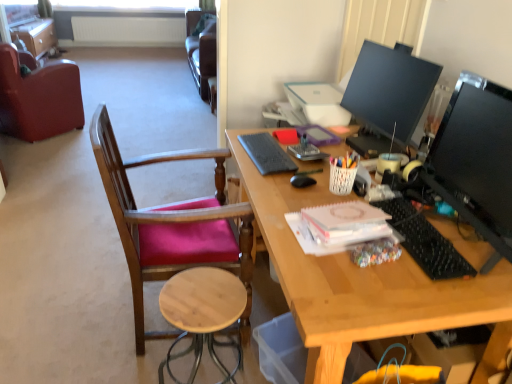
The image size is (512, 384). What are the coordinates of `free location to the right of leather at left, marked as the first chair in a left-to-right arrangement` in the screenshot? It's located at (115, 137).